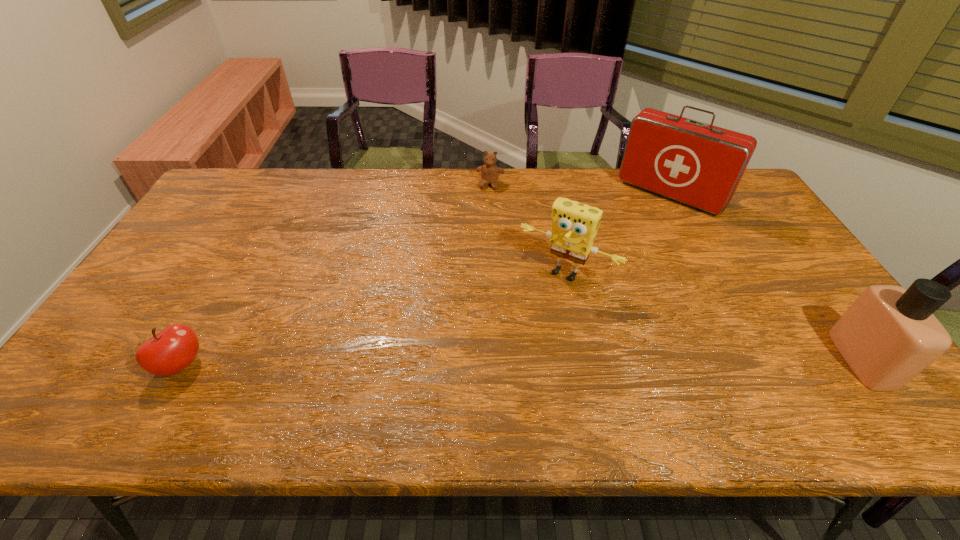
I want to click on perfume that is positioned at the near edge, so click(x=889, y=335).

Find the location of a particular element. The width and height of the screenshot is (960, 540). perfume located at the right edge is located at coordinates (889, 335).

You are a GUI agent. You are given a task and a screenshot of the screen. Output one action in this format:
    pyautogui.click(x=<x>, y=<y>)
    Task: Click on the first-aid kit situated at the right edge
    
    Given the screenshot: What is the action you would take?
    pyautogui.click(x=698, y=164)

The image size is (960, 540). I want to click on object located in the far right corner section of the desktop, so click(698, 164).

The image size is (960, 540). Find the location of `object that is at the near right corner`. object that is at the near right corner is located at coordinates (889, 335).

Locate an element on the screen. This screenshot has width=960, height=540. vacant point at the far edge is located at coordinates (627, 188).

You are a GUI agent. You are given a task and a screenshot of the screen. Output one action in this format:
    pyautogui.click(x=<x>, y=<y>)
    Task: Click on the free location at the near edge
    This screenshot has height=540, width=960.
    Given the screenshot: What is the action you would take?
    pyautogui.click(x=645, y=350)

This screenshot has height=540, width=960. Identify the location of vacant space at the right edge of the desktop. (808, 289).

Locate an element on the screen. The height and width of the screenshot is (540, 960). free spot at the near left corner of the desktop is located at coordinates (97, 378).

Find the location of a particular element. Image resolution: width=960 pixels, height=540 pixels. free space between the third nearest object and the tallest object is located at coordinates (618, 233).